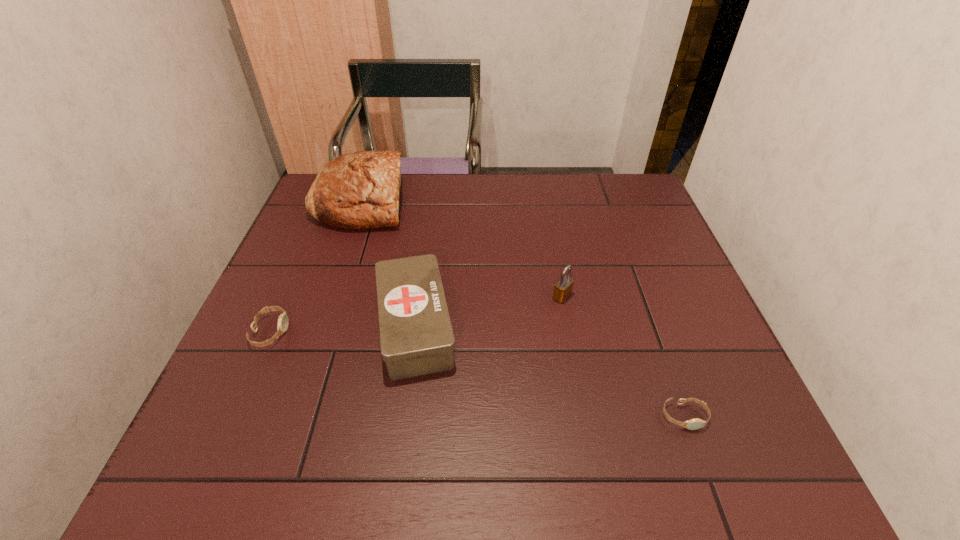
This screenshot has width=960, height=540. Identify the location of free point at the left edge. (261, 325).

I want to click on vacant space at the right edge of the desktop, so click(751, 418).

What are the coordinates of `free space at the far right corner of the desktop` in the screenshot? It's located at (597, 199).

Where is `free space at the near right corner`? Image resolution: width=960 pixels, height=540 pixels. free space at the near right corner is located at coordinates (739, 478).

You are a GUI agent. You are given a task and a screenshot of the screen. Output one action in this format:
    pyautogui.click(x=<x>, y=<y>)
    Task: Click on the free space between the bread and the second object from right to left
    Image resolution: width=960 pixels, height=540 pixels.
    Given the screenshot: What is the action you would take?
    pyautogui.click(x=462, y=249)

Where is `vacant space that is in between the fourth tallest object and the bread`? vacant space that is in between the fourth tallest object and the bread is located at coordinates 316,267.

The height and width of the screenshot is (540, 960). What are the coordinates of `free space between the right watch and the farthest object` in the screenshot? It's located at (522, 309).

Locate an element on the screen. Image resolution: width=960 pixels, height=540 pixels. empty location between the tallest object and the taller watch is located at coordinates (316, 267).

This screenshot has width=960, height=540. Identify the location of free space between the nearest object and the bread. (522, 309).

Image resolution: width=960 pixels, height=540 pixels. What are the coordinates of `object that ranks as the fourth closest to the second shortest object` in the screenshot? It's located at (693, 424).